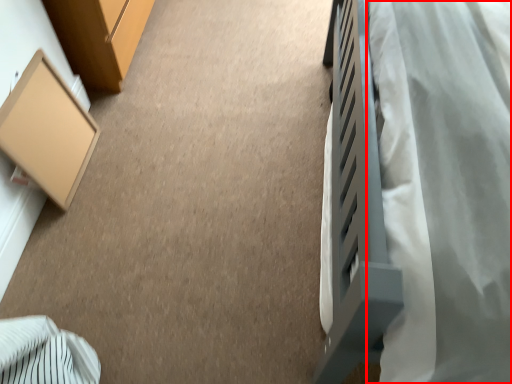
Question: Considering the relative positions of blanket (annotated by the red box) and furniture in the image provided, where is blanket (annotated by the red box) located with respect to the staircase?

Choices:
 (A) right
 (B) left

Answer: (A)